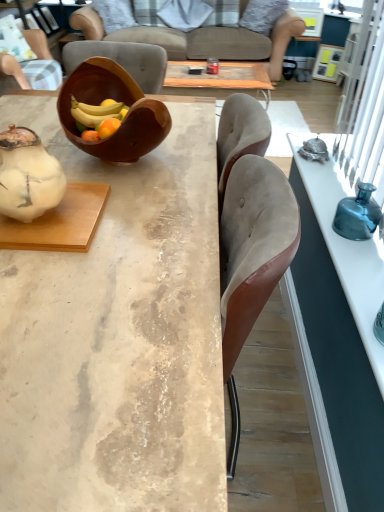
This screenshot has width=384, height=512. Find the location of `free space in front of white matte teapot at left`. free space in front of white matte teapot at left is located at coordinates (41, 270).